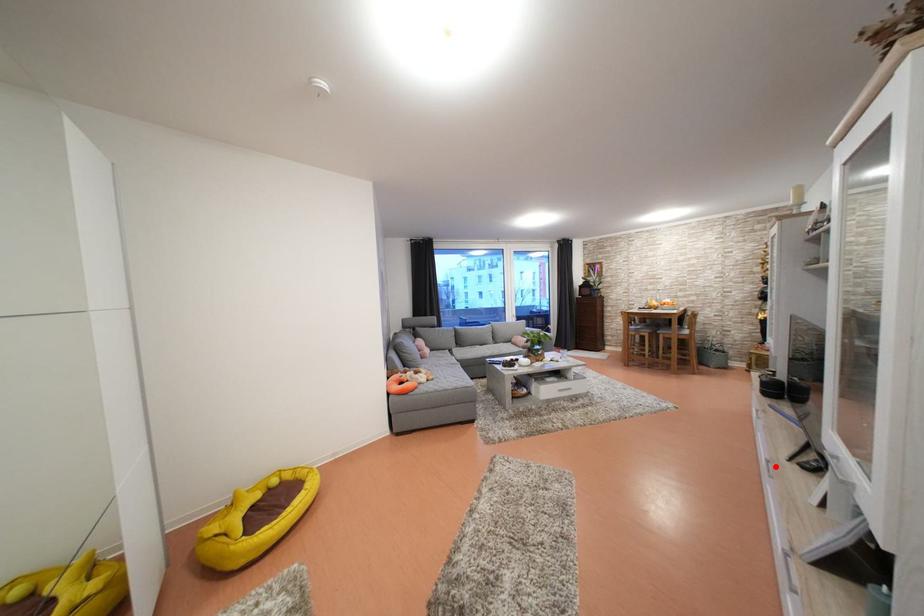
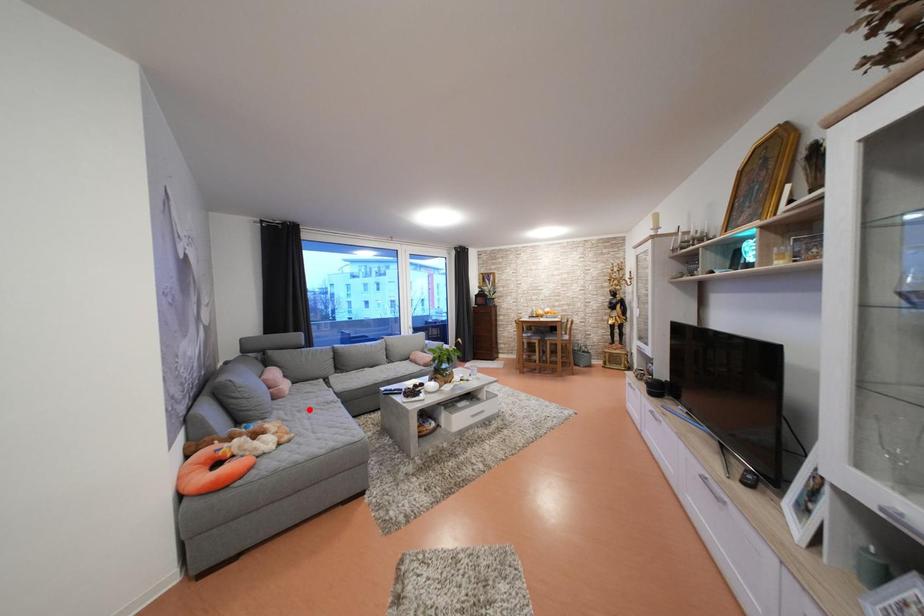
I am providing you with two images of the same scene from different viewpoints. A red point is marked on the first image and another point is marked on the second image. Is the marked point in image1 the same physical position as the marked point in image2?

No